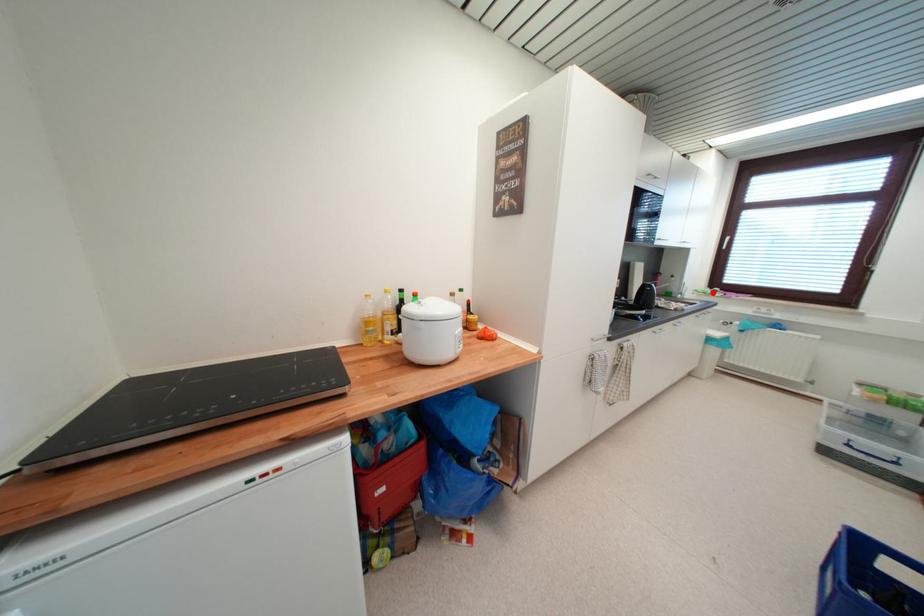
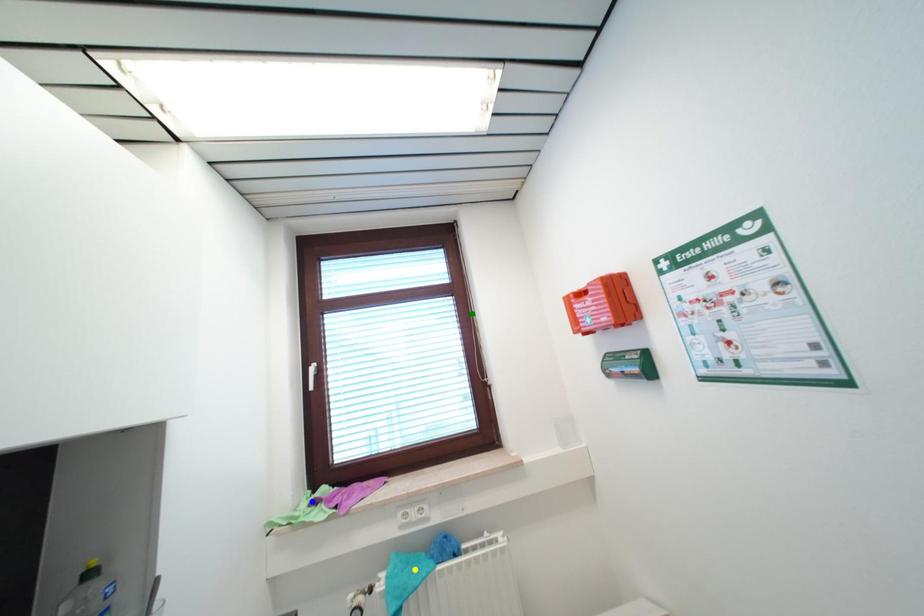
Question: I am providing you with two images of the same scene from different viewpoints. A red point is marked on the first image. You are given multiple points on the second image. Which point in image 2 is actually the same real-world point as the red point in image 1?

Choices:
 (A) blue point
 (B) green point
 (C) yellow point

Answer: (A)